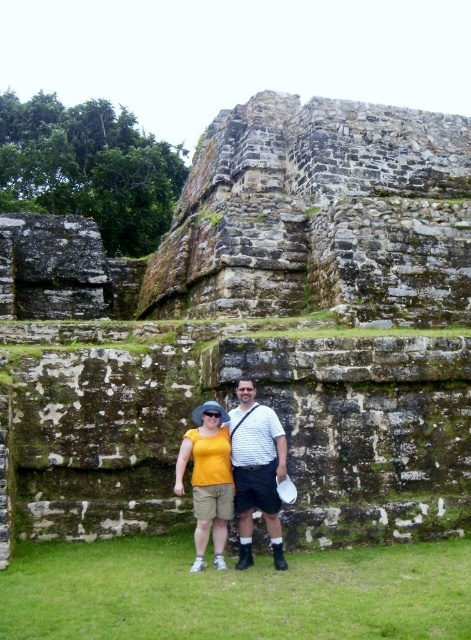
You are a photographer trying to capture a balanced composition. You have two subjects wearing white striped shirt at center and yellow matte shirt at center. Based on their heights, which subject should you place in the foreground to create a visually balanced image?

The white striped shirt at center has a lesser height compared to yellow matte shirt at center. To create a visually balanced image, place the taller yellow matte shirt at center in the foreground and the shorter white striped shirt at center slightly behind to compensate for the height difference.

You are a photographer trying to capture the two people in the scene. You notice the white striped shirt at center and the yellow matte shirt at center. Which shirt is covering part of the other?

The white striped shirt at center is positioned over the yellow matte shirt at center, so it is covering part of the yellow matte shirt at center.

You are standing at the point labeled as point (211, 444) and want to walk towards the point labeled as point (267, 531). Based on the coordinates provided, will you be moving forward or backward relative to your current position?

Since point (267, 531) is in front of point (211, 444), moving towards it would mean you are moving forward relative to your current position.